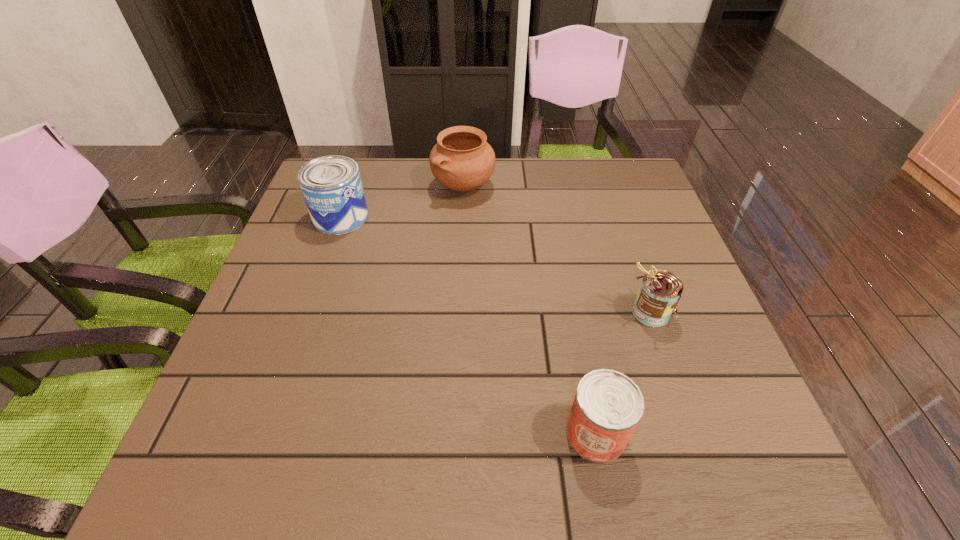
Where is `free spot between the second nearest can and the second object from right to left`? free spot between the second nearest can and the second object from right to left is located at coordinates (623, 373).

This screenshot has height=540, width=960. In order to click on free space between the pottery and the farthest can in this screenshot , I will do `click(402, 201)`.

Identify the location of the second closest object to the third object from left to right. This screenshot has height=540, width=960. (462, 160).

Image resolution: width=960 pixels, height=540 pixels. In order to click on object that is the third closest to the second object from left to right in this screenshot , I will do `click(608, 405)`.

You are a GUI agent. You are given a task and a screenshot of the screen. Output one action in this format:
    pyautogui.click(x=<x>, y=<y>)
    Task: Click on the second closest can to the leftmost object
    The height and width of the screenshot is (540, 960).
    Given the screenshot: What is the action you would take?
    pyautogui.click(x=608, y=405)

In order to click on can that stands as the closest to the rightmost object in this screenshot , I will do coord(608,405).

Identify the location of blank space that satisfies the following two spatial constraints: 1. on the front label of the second can from right to left; 2. on the left side of the farthest can. The height and width of the screenshot is (540, 960). (265, 434).

Identify the location of vacant region that satisfies the following two spatial constraints: 1. on the front side of the pottery; 2. on the left side of the nearest object. (452, 434).

Image resolution: width=960 pixels, height=540 pixels. Identify the location of vacant point that satisfies the following two spatial constraints: 1. on the back side of the rightmost object; 2. on the front label of the leftmost object. (617, 217).

Find the location of `free space that satisfies the following two spatial constraints: 1. on the front label of the farthest can; 2. on the right side of the second can from right to left`. free space that satisfies the following two spatial constraints: 1. on the front label of the farthest can; 2. on the right side of the second can from right to left is located at coordinates (265, 434).